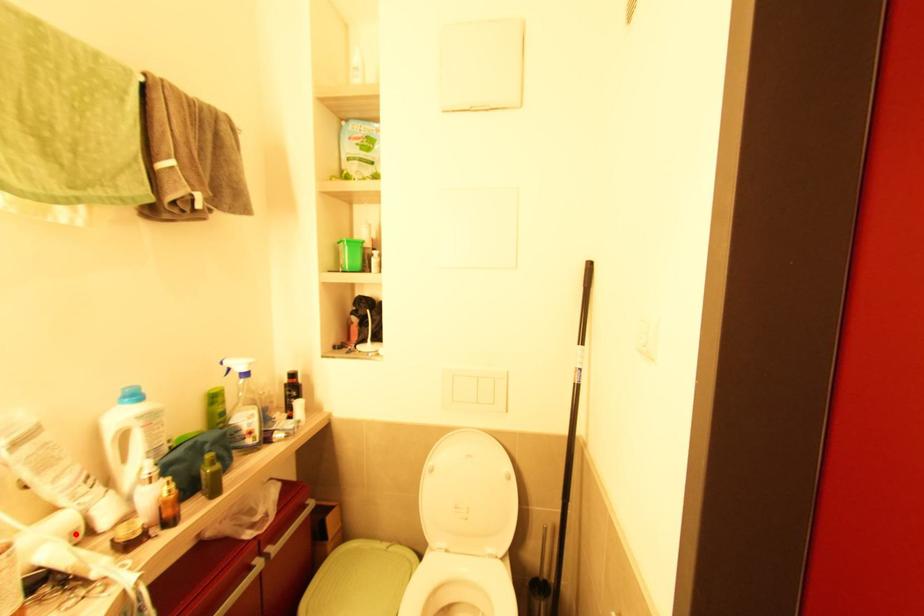
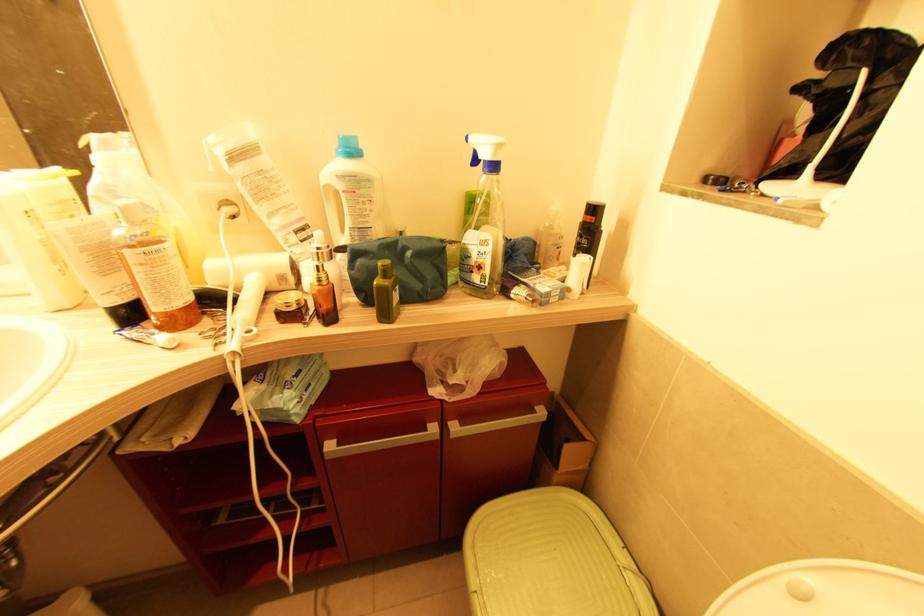
In the second image, find the point that corresponds to the highlighted location in the first image.

(284, 278)